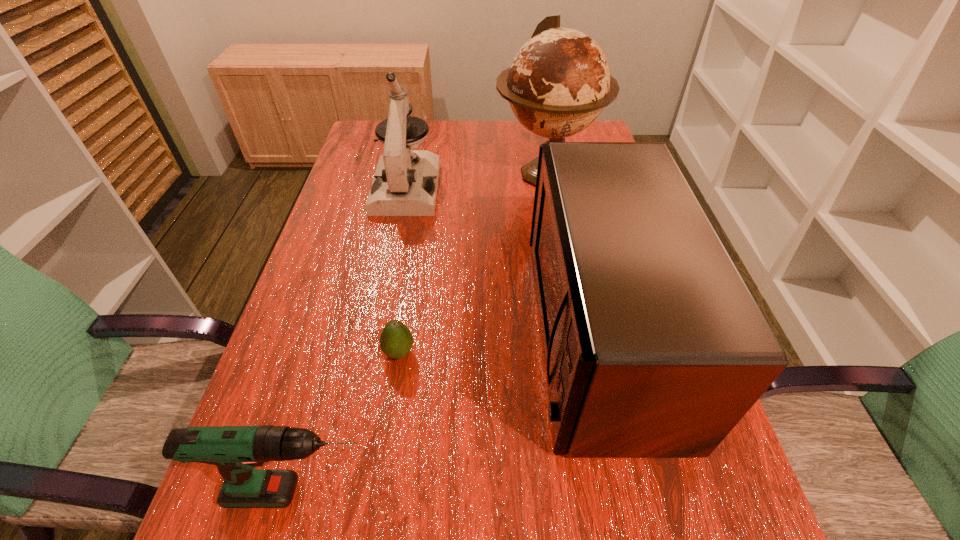
Find the location of a particular element. The image size is (960, 540). vacant area at the left edge of the desktop is located at coordinates (273, 363).

Find the location of `free location at the right edge of the desktop`. free location at the right edge of the desktop is located at coordinates (736, 508).

Locate an element on the screen. free point between the microwave_oven and the second shortest object is located at coordinates (450, 412).

Find the location of a particular element. vacant area that lies between the avocado and the microscope is located at coordinates (403, 270).

The image size is (960, 540). What are the coordinates of `vacant area that lies between the nearest object and the microscope` in the screenshot? It's located at (354, 340).

What are the coordinates of `empty location between the globe and the microscope` in the screenshot? It's located at (476, 181).

Where is `empty location between the microscope and the avocado`? This screenshot has width=960, height=540. empty location between the microscope and the avocado is located at coordinates (403, 270).

The width and height of the screenshot is (960, 540). Find the location of `free area in between the avocado and the tallest object`. free area in between the avocado and the tallest object is located at coordinates (472, 264).

At what (x,y) coordinates should I click in order to perform the action: click on empty space between the microscope and the shortest object. Please return your answer as a coordinate pair (x, y). This screenshot has height=540, width=960. Looking at the image, I should click on (403, 270).

Locate which object ranks second in proximity to the fourth tallest object. Please provide its 2D coordinates. Your answer should be formatted as a tuple, i.e. [(x, y)], where the tuple contains the x and y coordinates of a point satisfying the conditions above.

[(654, 347)]